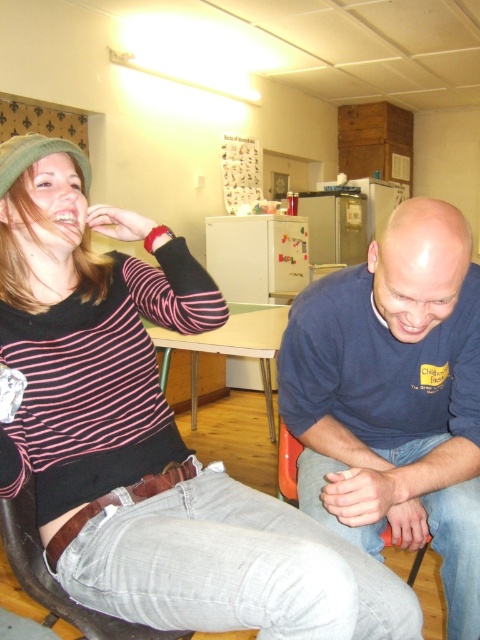
Can you confirm if brown leather chair at lower left is taller than orange plastic chair at lower center?

No, brown leather chair at lower left is not taller than orange plastic chair at lower center.

Is brown leather chair at lower left shorter than orange plastic chair at lower center?

Yes, brown leather chair at lower left is shorter than orange plastic chair at lower center.

What are the coordinates of `brown leather chair at lower left` in the screenshot? It's located at (54, 579).

Can you confirm if blue cotton shirt at lower right is shorter than light brown wooden table at center?

Incorrect, blue cotton shirt at lower right's height does not fall short of light brown wooden table at center's.

Does point (394, 461) lie in front of point (240, 353)?

That is True.

The height and width of the screenshot is (640, 480). What are the coordinates of `blue cotton shirt at lower right` in the screenshot? It's located at (395, 397).

Is striped knit sweater at upper left behind light brown wooden table at center?

No, it is not.

At what (x,y) coordinates should I click in order to perform the action: click on striped knit sweater at upper left. Please return your answer as a coordinate pair (x, y). The width and height of the screenshot is (480, 640). Looking at the image, I should click on (146, 435).

Find the location of `striped knit sweater at upper left`. striped knit sweater at upper left is located at coordinates (146, 435).